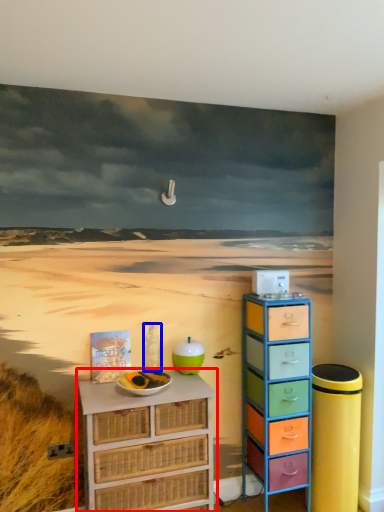
Question: Which of the following is the closest to the observer, chest of drawers (highlighted by a red box) or bottle (highlighted by a blue box)?

Choices:
 (A) chest of drawers
 (B) bottle

Answer: (A)